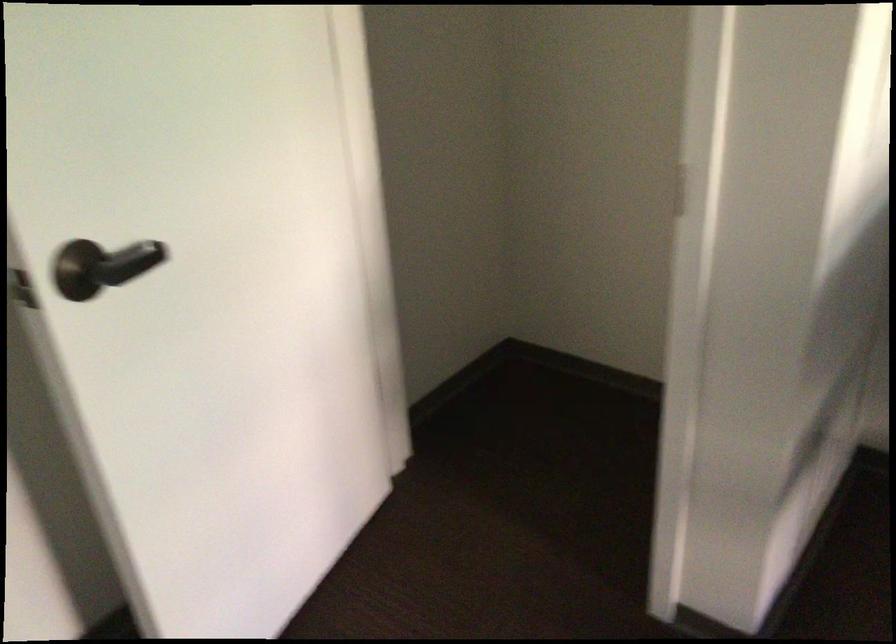
Where is `dark door handle`? Image resolution: width=896 pixels, height=644 pixels. dark door handle is located at coordinates (107, 265).